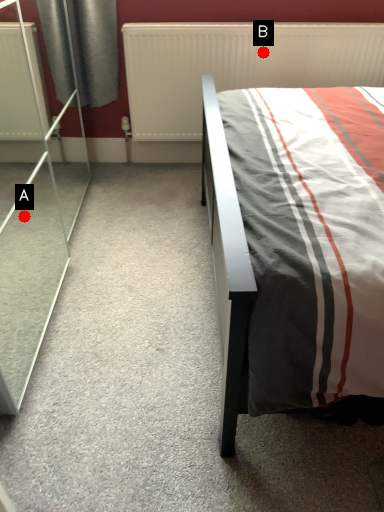
Question: Two points are circled on the image, labeled by A and B beside each circle. Which point is closer to the camera?

Choices:
 (A) A is closer
 (B) B is closer

Answer: (A)